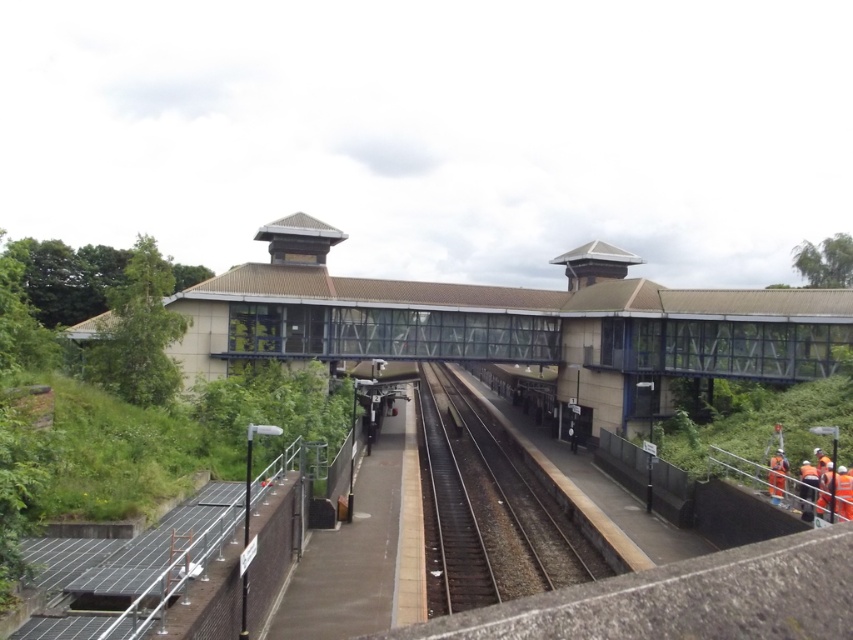
Question: Does smooth steel tracks at center have a smaller size compared to orange reflective vest at lower right?

Choices:
 (A) yes
 (B) no

Answer: (B)

Question: Which point appears farthest from the camera in this image?

Choices:
 (A) (822, 509)
 (B) (805, 480)

Answer: (B)

Question: Does smooth steel tracks at center have a larger size compared to orange reflective vest at lower right?

Choices:
 (A) no
 (B) yes

Answer: (B)

Question: Which is farther from the orange reflective rail at lower right?

Choices:
 (A) smooth steel tracks at center
 (B) orange reflective safety vest at right
 (C) orange reflective vest at lower right

Answer: (A)

Question: Estimate the real-world distances between objects in this image. Which object is closer to the orange reflective rail at lower right?

Choices:
 (A) orange reflective vest at lower right
 (B) orange reflective safety vest at right

Answer: (B)

Question: Is orange reflective rail at lower right wider than orange reflective vest at lower right?

Choices:
 (A) yes
 (B) no

Answer: (A)